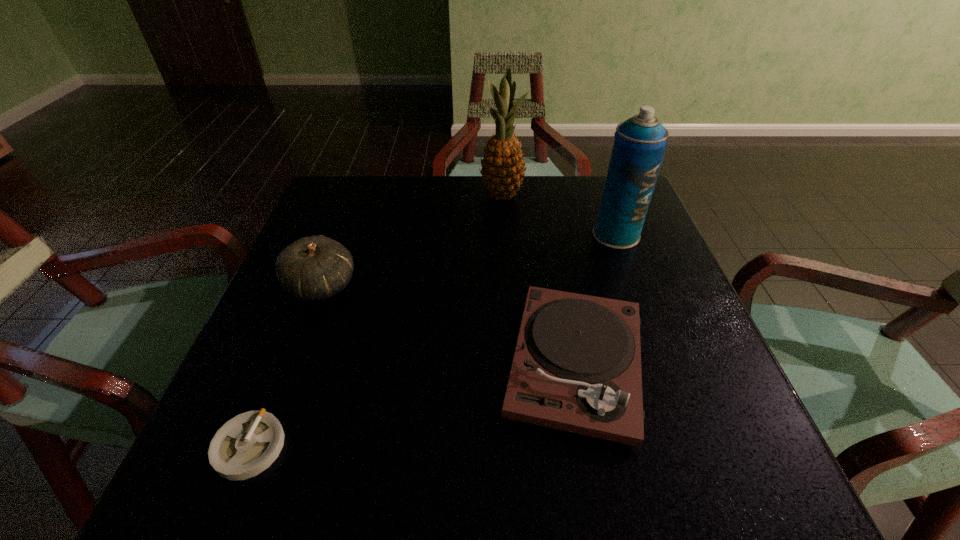
I want to click on the farthest object, so click(x=503, y=169).

Find the location of a particular element. The width and height of the screenshot is (960, 540). the second farthest object is located at coordinates (640, 143).

At what (x,y) coordinates should I click in order to perform the action: click on gourd. Please return your answer as a coordinate pair (x, y). The width and height of the screenshot is (960, 540). Looking at the image, I should click on (312, 268).

Identify the location of the second shortest object. This screenshot has height=540, width=960. (576, 367).

Locate an element on the screen. The width and height of the screenshot is (960, 540). ashtray is located at coordinates (246, 445).

The width and height of the screenshot is (960, 540). What are the coordinates of `vacant space located 0.400m on the left of the farthest object` in the screenshot? It's located at (331, 195).

Find the location of a particular element. This screenshot has width=960, height=540. free space located 0.090m on the back of the fourth nearest object is located at coordinates (604, 201).

This screenshot has width=960, height=540. Find the location of `vacant area situated 0.170m on the back of the gourd`. vacant area situated 0.170m on the back of the gourd is located at coordinates (347, 219).

At what (x,y) coordinates should I click in order to perform the action: click on free space located on the right of the fourth tallest object. Please return your answer as a coordinate pair (x, y). Image resolution: width=960 pixels, height=540 pixels. Looking at the image, I should click on (708, 363).

This screenshot has height=540, width=960. In order to click on free space located on the right of the ashtray in this screenshot , I will do `click(374, 447)`.